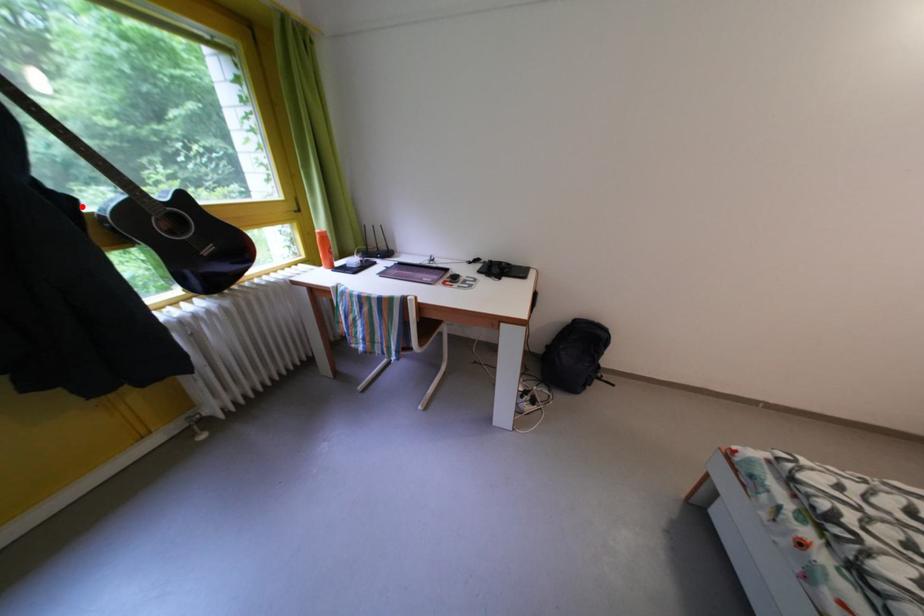
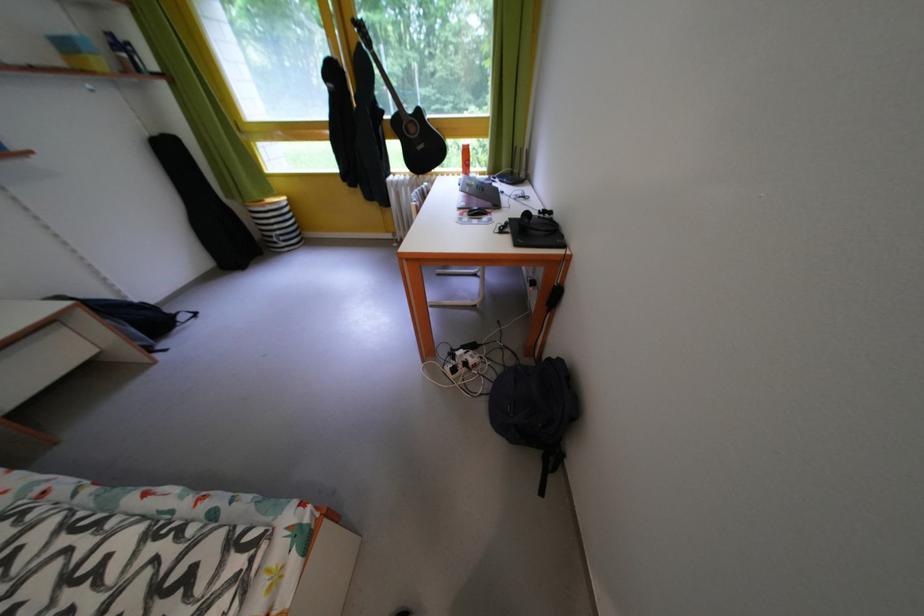
Question: I am providing you with two images of the same scene from different viewpoints. Given a red point in image1, look at the same physical point in image2. Is it:

Choices:
 (A) Closer to the viewpoint
 (B) Farther from the viewpoint

Answer: (A)